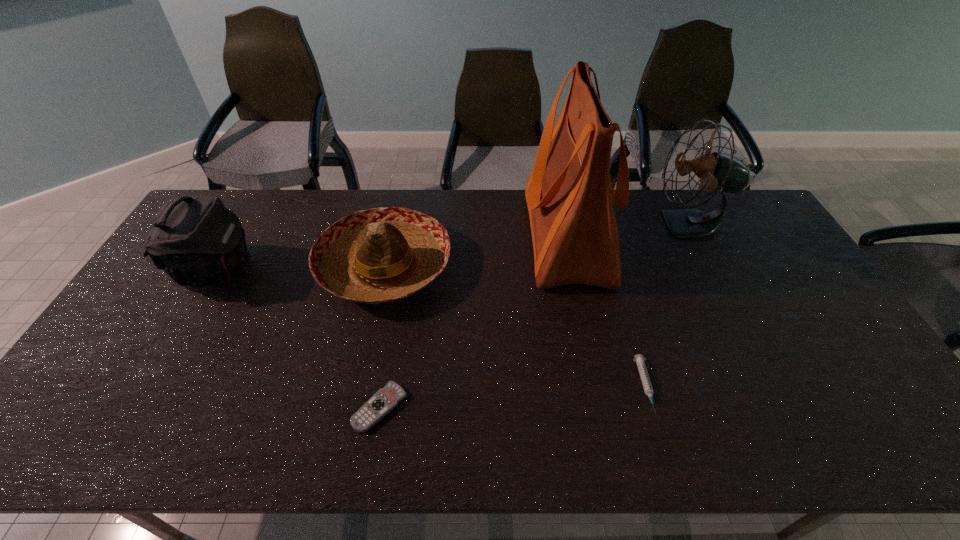
This screenshot has height=540, width=960. I want to click on free space between the remote control and the tallest object, so click(473, 322).

You are a GUI agent. You are given a task and a screenshot of the screen. Output one action in this format:
    pyautogui.click(x=<x>, y=<y>)
    Task: Click on the free point between the shoulder bag and the syringe
    This screenshot has height=540, width=960.
    Given the screenshot: What is the action you would take?
    pyautogui.click(x=432, y=329)

This screenshot has width=960, height=540. What are the coordinates of `unoccupied position between the leftmost object and the remote control` in the screenshot? It's located at (300, 339).

You are a GUI agent. You are given a task and a screenshot of the screen. Output one action in this format:
    pyautogui.click(x=<x>, y=<y>)
    Task: Click on the vacant area that lies between the shortest object and the tallest object
    The width and height of the screenshot is (960, 540).
    Given the screenshot: What is the action you would take?
    pyautogui.click(x=473, y=322)

The height and width of the screenshot is (540, 960). What are the coordinates of `free space between the fifth tallest object and the tallest object` in the screenshot? It's located at (606, 311).

Identify the location of free spot between the shortest object and the sombrero. This screenshot has height=540, width=960. (382, 337).

This screenshot has height=540, width=960. I want to click on free space between the shortest object and the sombrero, so point(382,337).

Point out which object is positioned as the second nearest to the second shortest object. Please provide its 2D coordinates. Your answer should be formatted as a tuple, i.e. [(x, y)], where the tuple contains the x and y coordinates of a point satisfying the conditions above.

[(717, 171)]

Find the location of `object that stands as the third closest to the shoulder bag`. object that stands as the third closest to the shoulder bag is located at coordinates (569, 194).

At what (x,y) coordinates should I click in order to perform the action: click on vacant point that satisfies the following two spatial constraints: 1. on the front side of the fourth tallest object; 2. on the open flap of the shoulder bag. Please return your answer as a coordinate pair (x, y). This screenshot has height=540, width=960. Looking at the image, I should click on (384, 271).